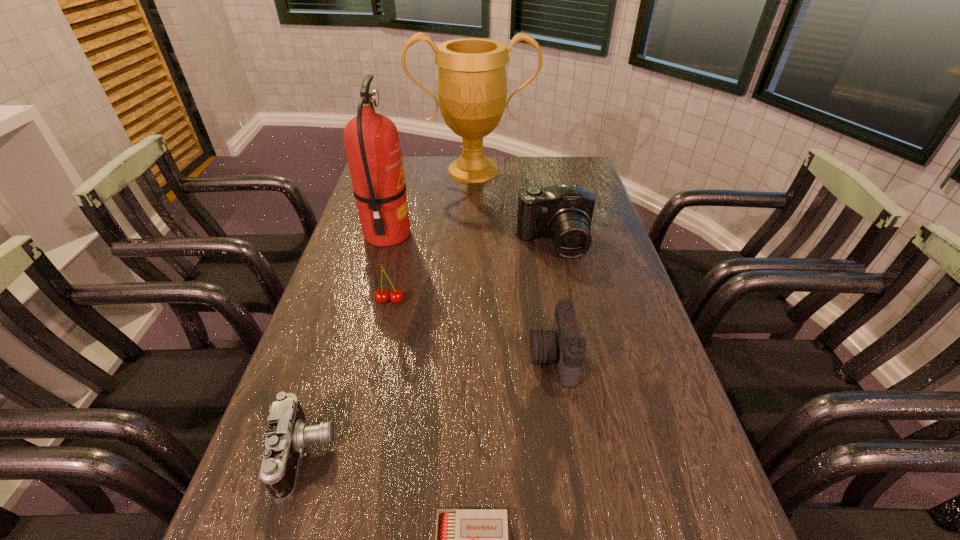
Where is `the farthest object`? Image resolution: width=960 pixels, height=540 pixels. the farthest object is located at coordinates (472, 88).

Where is `fire extinguisher`? fire extinguisher is located at coordinates (372, 144).

Image resolution: width=960 pixels, height=540 pixels. I want to click on the third tallest object, so click(563, 212).

Locate an element on the screen. the tallest camera is located at coordinates (563, 212).

Find the location of a particular element. the third nearest object is located at coordinates (563, 343).

The image size is (960, 540). Identify the location of the second nearest camera. coord(563,343).

The width and height of the screenshot is (960, 540). Identify the location of the fourth nearest object. (396, 296).

Image resolution: width=960 pixels, height=540 pixels. I want to click on the shortest camera, so click(287, 434).

The image size is (960, 540). Identify the location of the sixth farthest object. (287, 434).

You are a GUI agent. You are given a task and a screenshot of the screen. Output one action in this format:
    pyautogui.click(x=<x>, y=<y>)
    Task: Click on the vacant space located 0.100m on the engravings side of the farthest object
    The width and height of the screenshot is (960, 540).
    Given the screenshot: What is the action you would take?
    pyautogui.click(x=472, y=201)